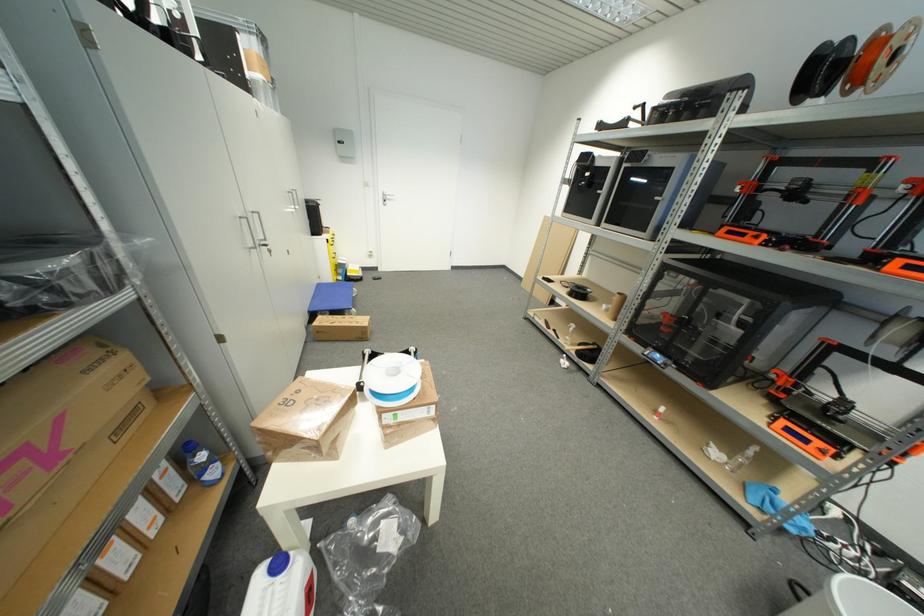
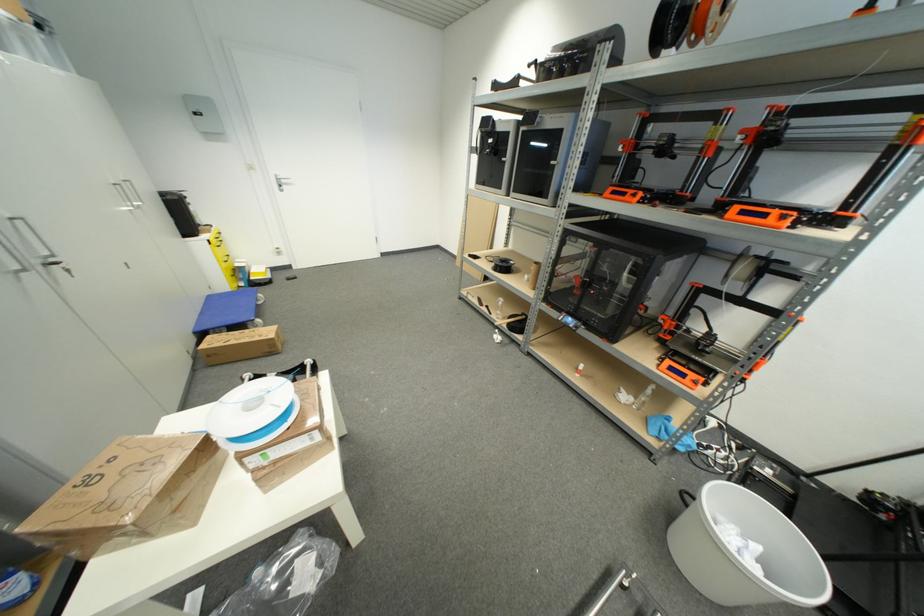
Where in the second image is the point corresponding to pixel 261 245 from the first image?

(43, 264)